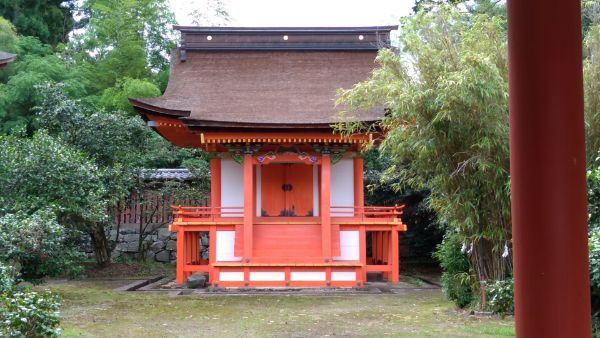
In order to click on support beam in this screenshot , I will do `click(182, 257)`, `click(194, 249)`, `click(190, 252)`, `click(375, 244)`, `click(382, 244)`, `click(387, 245)`, `click(393, 251)`.